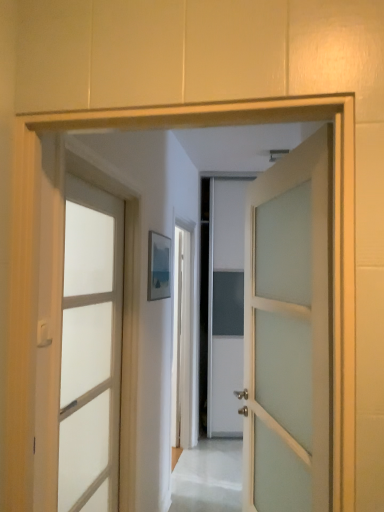
Question: Can you confirm if translucent glass door at center, which is the second door in right-to-left order, is positioned to the left of matte white door handle at left?

Choices:
 (A) no
 (B) yes

Answer: (A)

Question: Considering the relative sizes of translucent glass door at center, which is the second door in right-to-left order, and matte white door handle at left in the image provided, is translucent glass door at center, which is the second door in right-to-left order, wider than matte white door handle at left?

Choices:
 (A) no
 (B) yes

Answer: (B)

Question: Does translucent glass door at center, which is the second door in right-to-left order, have a lesser width compared to matte white door handle at left?

Choices:
 (A) no
 (B) yes

Answer: (A)

Question: Is translucent glass door at center, which is the second door in right-to-left order, positioned before matte white door handle at left?

Choices:
 (A) no
 (B) yes

Answer: (A)

Question: Does translucent glass door at center, which is the second door in right-to-left order, have a larger size compared to matte white door handle at left?

Choices:
 (A) no
 (B) yes

Answer: (B)

Question: From the image's perspective, does translucent glass door at center, which is the second door in right-to-left order, appear lower than matte white door handle at left?

Choices:
 (A) no
 (B) yes

Answer: (B)

Question: Is matte white door handle at left to the right of translucent glass door at center, which is the second door in right-to-left order, from the viewer's perspective?

Choices:
 (A) yes
 (B) no

Answer: (B)

Question: Is matte white door handle at left smaller than translucent glass door at center, the 1th door from the left?

Choices:
 (A) yes
 (B) no

Answer: (A)

Question: Is matte white door handle at left directly adjacent to translucent glass door at center, which is the second door in right-to-left order?

Choices:
 (A) no
 (B) yes

Answer: (A)

Question: Can you confirm if matte white door handle at left is bigger than translucent glass door at center, which is the second door in right-to-left order?

Choices:
 (A) no
 (B) yes

Answer: (A)

Question: Is matte white door handle at left not inside translucent glass door at center, the 1th door from the left?

Choices:
 (A) no
 (B) yes

Answer: (B)

Question: Considering the relative sizes of matte white door handle at left and translucent glass door at center, which is the second door in right-to-left order, in the image provided, is matte white door handle at left taller than translucent glass door at center, which is the second door in right-to-left order,?

Choices:
 (A) no
 (B) yes

Answer: (A)

Question: Is matte white door handle at left touching white frosted glass door at center, which is the 1th door in right-to-left order?

Choices:
 (A) yes
 (B) no

Answer: (B)